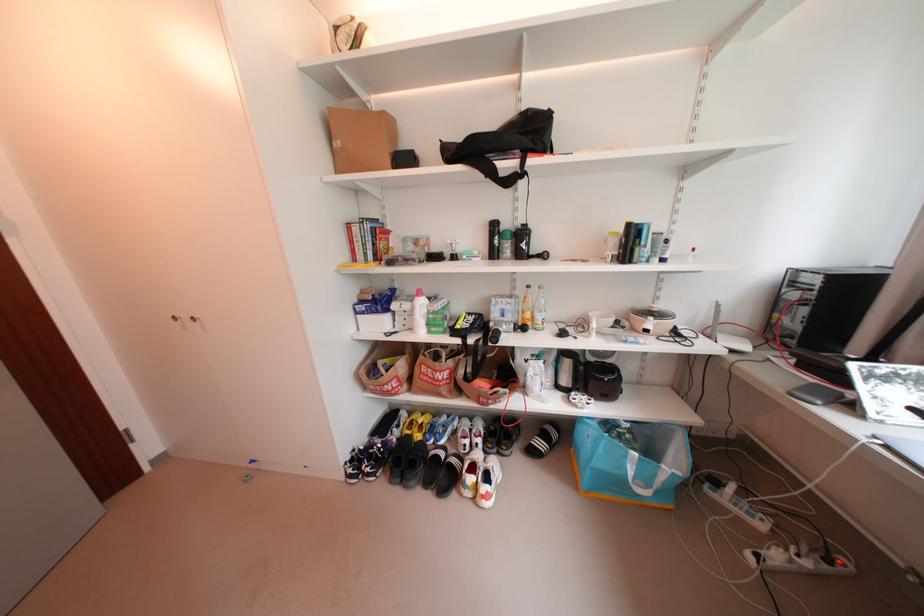
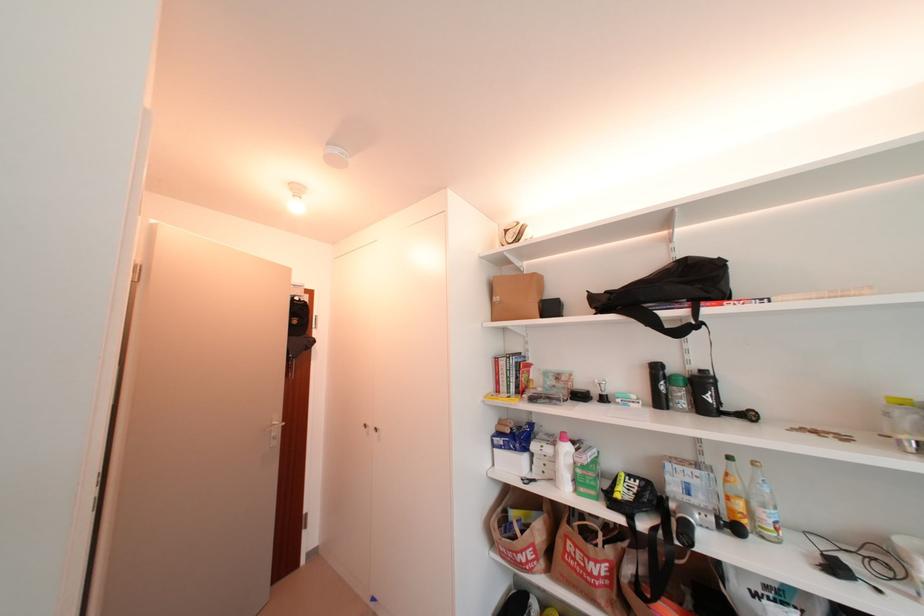
How did the camera likely rotate?

The rotation direction of the camera is left-up.